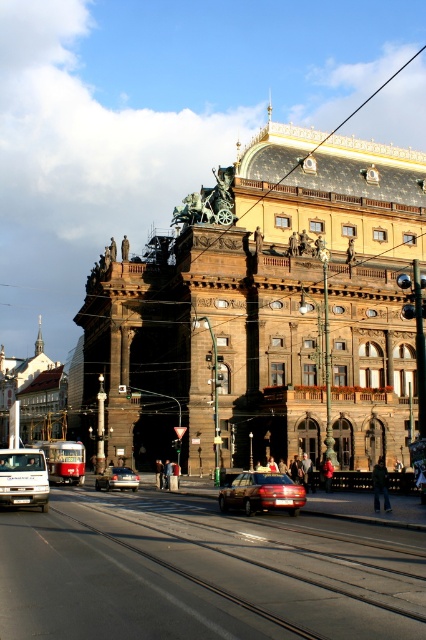
Is metal train track at lower center to the right of silver metallic sedan at center from the viewer's perspective?

Indeed, metal train track at lower center is positioned on the right side of silver metallic sedan at center.

Consider the image. Measure the distance between metal train track at lower center and camera.

metal train track at lower center and camera are 77.26 feet apart from each other.

The width and height of the screenshot is (426, 640). Find the location of `metal train track at lower center`. metal train track at lower center is located at coordinates (264, 566).

Who is shorter, shiny red sedan at center or silver metallic sedan at center?

silver metallic sedan at center

Does point (264, 483) lie behind point (137, 477)?

No, (264, 483) is in front of (137, 477).

Locate an element on the screen. The height and width of the screenshot is (640, 426). shiny red sedan at center is located at coordinates (261, 493).

Identify the location of shiny red sedan at center. (261, 493).

Which is behind, point (45, 461) or point (123, 468)?

The point (123, 468) is behind.

Which is in front, point (46, 500) or point (120, 483)?

Point (46, 500) is more forward.

Between point (31, 486) and point (121, 486), which one is positioned behind?

The point (121, 486) is behind.

Locate an element on the screen. white matte van at lower left is located at coordinates (23, 477).